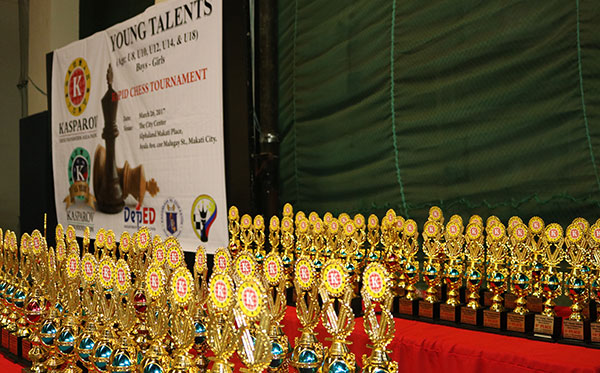
Image resolution: width=600 pixels, height=373 pixels. I want to click on red table cloth, so click(473, 348).